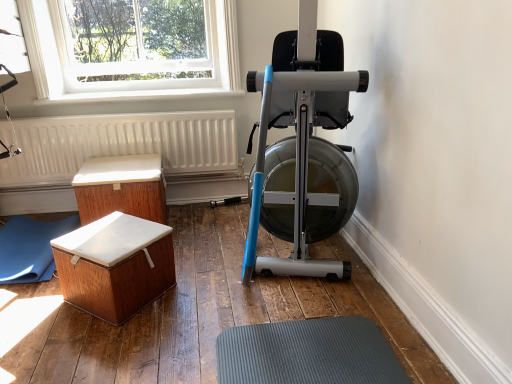
What are the coordinates of `free spot above white wood chest at lower left, placed as the 2th furniture when sorted from front to back (from a real-world perspective)` in the screenshot? It's located at (119, 168).